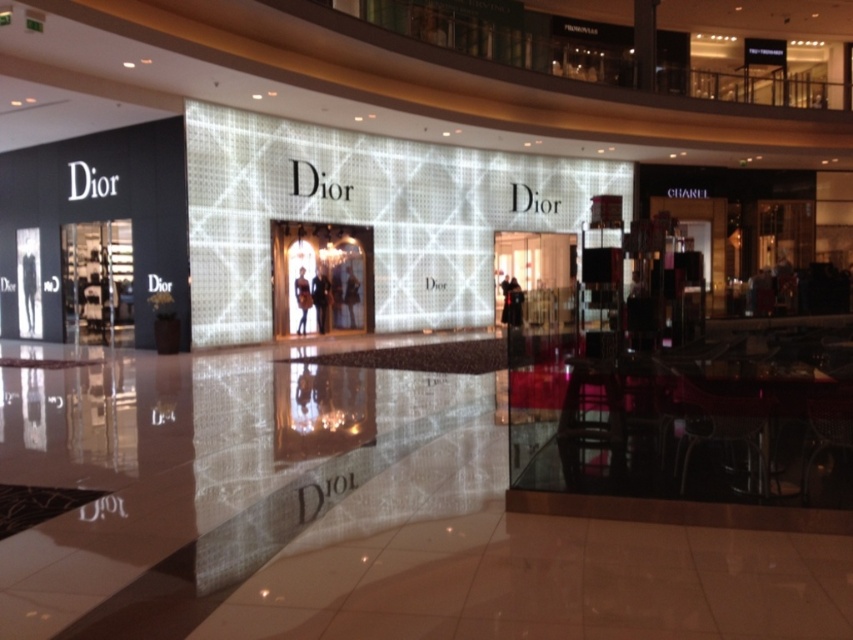
Question: Is dark fabric coat at center behind matte black dress at center?

Choices:
 (A) yes
 (B) no

Answer: (A)

Question: Is dark fabric coat at center closer to camera compared to matte black dress at center?

Choices:
 (A) yes
 (B) no

Answer: (B)

Question: Which point appears farthest from the camera in this image?

Choices:
 (A) (297, 324)
 (B) (316, 275)

Answer: (B)

Question: Which of the following is the farthest from the observer?

Choices:
 (A) dark fabric coat at center
 (B) matte black dress at center

Answer: (A)

Question: Observing the image, what is the correct spatial positioning of dark fabric coat at center in reference to matte black dress at center?

Choices:
 (A) right
 (B) left

Answer: (A)